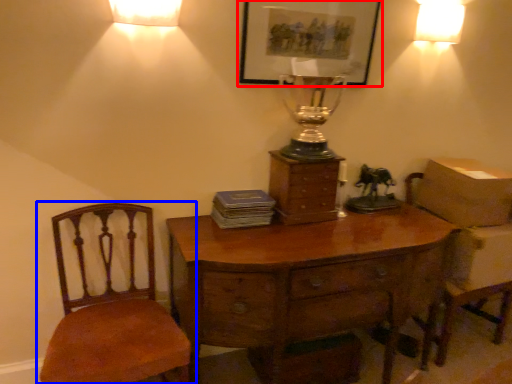
Question: Among these objects, which one is farthest to the camera, picture frame (highlighted by a red box) or chair (highlighted by a blue box)?

Choices:
 (A) picture frame
 (B) chair

Answer: (A)